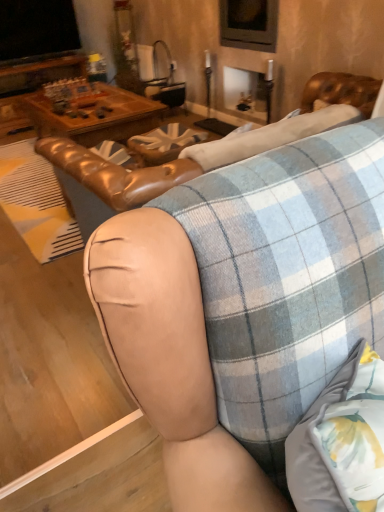
Question: Considering the positions of point (77, 211) and point (223, 410), is point (77, 211) closer or farther from the camera than point (223, 410)?

Choices:
 (A) closer
 (B) farther

Answer: (B)

Question: Do you think leather at center is within leather couch at center, or outside of it?

Choices:
 (A) outside
 (B) inside

Answer: (A)

Question: From the image's perspective, relative to leather couch at center, is leather at center above or below?

Choices:
 (A) above
 (B) below

Answer: (B)

Question: Is point (299, 284) closer or farther from the camera than point (357, 117)?

Choices:
 (A) closer
 (B) farther

Answer: (A)

Question: Relative to leather at center, is leather couch at center in front or behind?

Choices:
 (A) behind
 (B) front

Answer: (A)

Question: From the image's perspective, is leather couch at center positioned above or below leather at center?

Choices:
 (A) above
 (B) below

Answer: (A)

Question: From a real-world perspective, is leather couch at center above or below leather at center?

Choices:
 (A) above
 (B) below

Answer: (B)